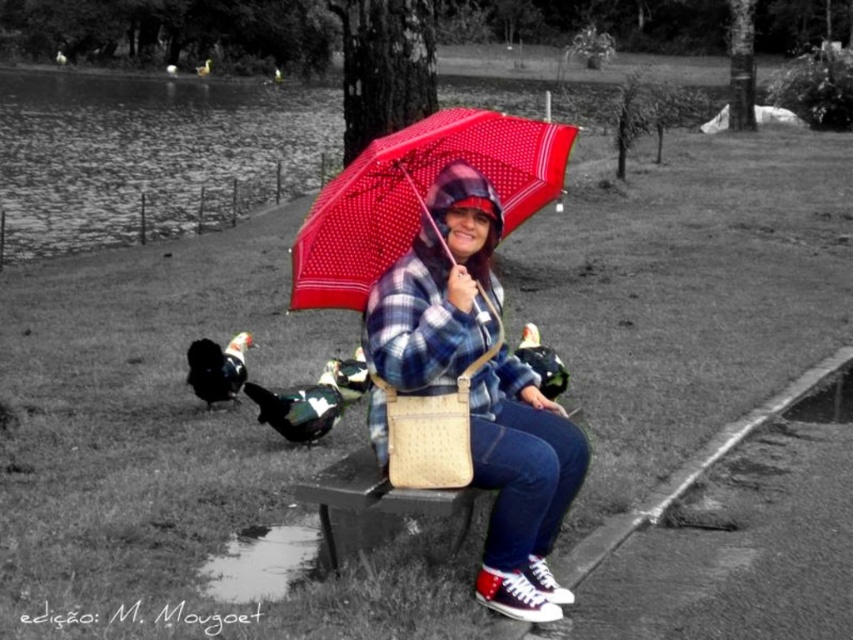
Question: From the image, what is the correct spatial relationship of matte plaid jacket at center in relation to polka dot fabric umbrella at center?

Choices:
 (A) left
 (B) right

Answer: (A)

Question: Is matte plaid jacket at center bigger than polka dot fabric umbrella at center?

Choices:
 (A) yes
 (B) no

Answer: (A)

Question: Can you confirm if matte plaid jacket at center is positioned below polka dot fabric umbrella at center?

Choices:
 (A) no
 (B) yes

Answer: (B)

Question: Which point is farther from the camera taking this photo?

Choices:
 (A) (442, 230)
 (B) (346, 166)

Answer: (B)